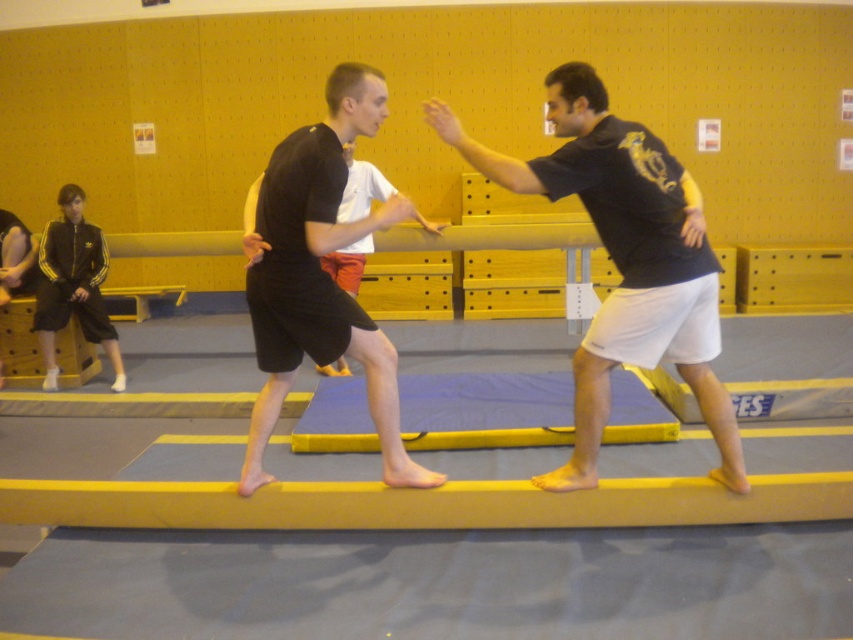
Question: Is the position of black matte t-shirt at center less distant than that of blue foam mat at center?

Choices:
 (A) yes
 (B) no

Answer: (A)

Question: Among these points, which one is farthest from the camera?

Choices:
 (A) (482, 154)
 (B) (76, 516)

Answer: (B)

Question: Is yellow foam beam at center further to the viewer compared to black matte shorts at center?

Choices:
 (A) no
 (B) yes

Answer: (B)

Question: Which point is closer to the camera taking this photo?

Choices:
 (A) (479, 401)
 (B) (666, 212)
 (C) (294, 356)

Answer: (B)

Question: Which point appears farthest from the camera in this image?

Choices:
 (A) click(x=640, y=141)
 (B) click(x=273, y=262)
 (C) click(x=355, y=438)
 (D) click(x=119, y=497)

Answer: (C)

Question: Is yellow foam beam at center to the left of blue foam mat at center from the viewer's perspective?

Choices:
 (A) yes
 (B) no

Answer: (A)